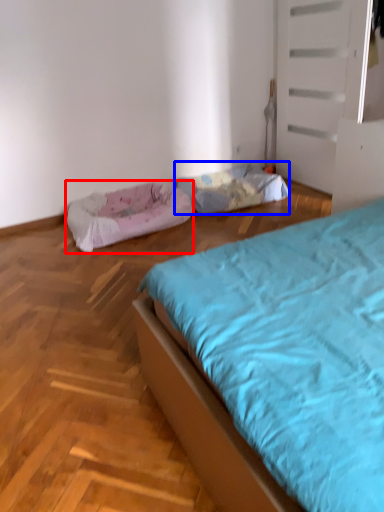
Question: Among these objects, which one is nearest to the camera, dog bed (highlighted by a red box) or blanket (highlighted by a blue box)?

Choices:
 (A) dog bed
 (B) blanket

Answer: (A)